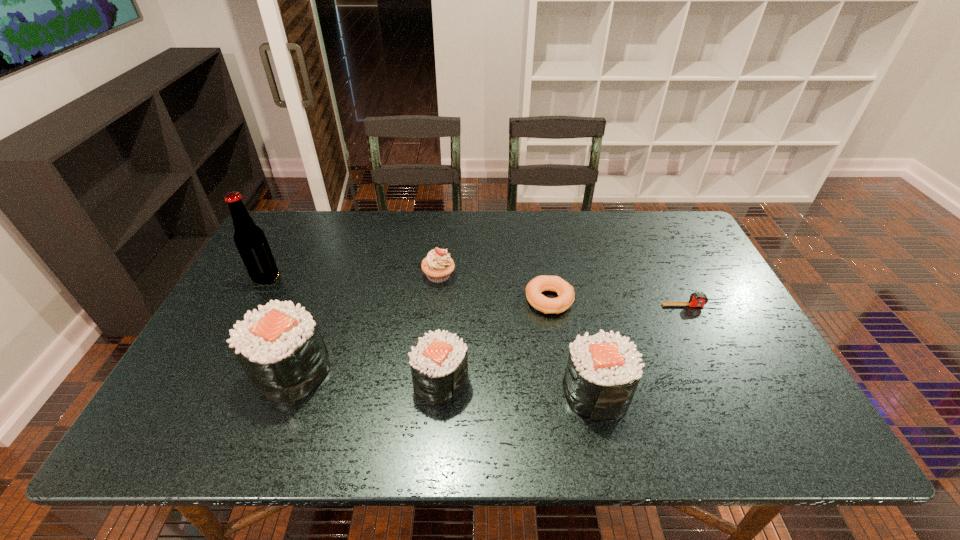
Please point a spot to add another sushi on the right. Please provide its 2D coordinates. Your answer should be formatted as a tuple, i.e. [(x, y)], where the tuple contains the x and y coordinates of a point satisfying the conditions above.

[(758, 403)]